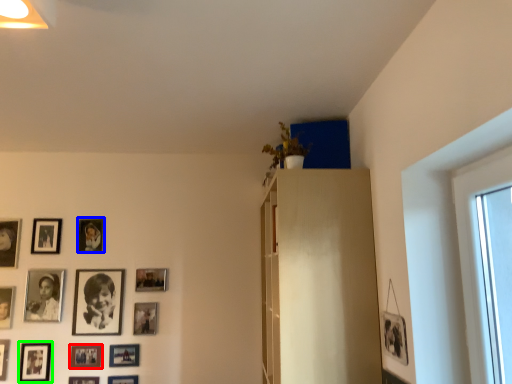
Question: Which object is positioned farthest from picture frame (highlighted by a red box)? Select from picture frame (highlighted by a blue box) and picture frame (highlighted by a green box).

Choices:
 (A) picture frame
 (B) picture frame

Answer: (A)